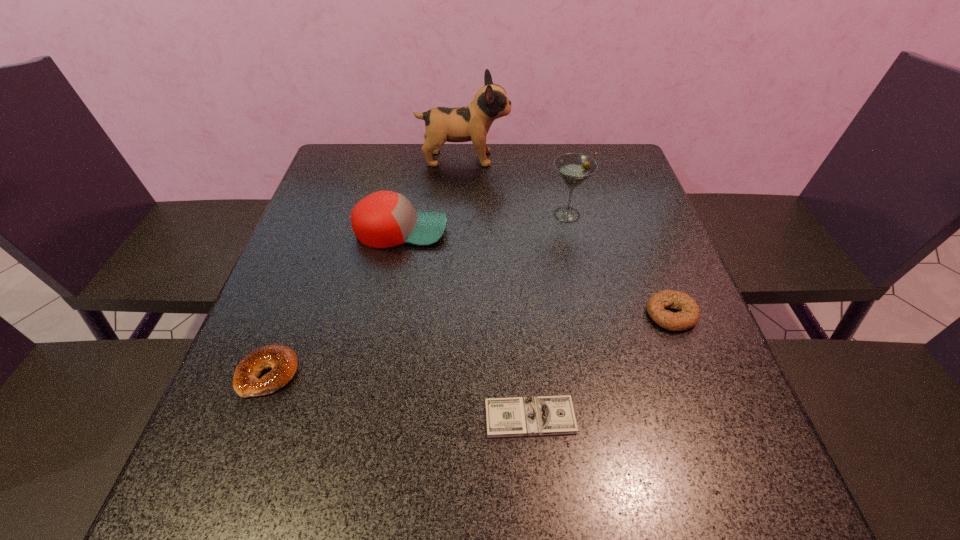
In the image, there is a desktop. In order to click on vacant area at the far edge in this screenshot , I will do `click(430, 169)`.

In the image, there is a desktop. Where is `vacant region at the near edge`? Image resolution: width=960 pixels, height=540 pixels. vacant region at the near edge is located at coordinates (346, 511).

Image resolution: width=960 pixels, height=540 pixels. I want to click on vacant region at the left edge of the desktop, so click(x=284, y=276).

What are the coordinates of `free spot at the right edge of the desktop` in the screenshot? It's located at (598, 190).

Find the location of a particular element. The width and height of the screenshot is (960, 540). blank space at the far left corner of the desktop is located at coordinates (328, 165).

In the image, there is a desktop. Where is `free space at the near left corner`? The width and height of the screenshot is (960, 540). free space at the near left corner is located at coordinates (258, 503).

Locate an element on the screen. free spot between the puppy and the shortest object is located at coordinates (497, 288).

This screenshot has height=540, width=960. I want to click on vacant area that lies between the right bagel and the farthest object, so click(x=567, y=237).

Locate an element on the screen. vacant area between the farthest object and the second object from right to left is located at coordinates (516, 187).

The width and height of the screenshot is (960, 540). I want to click on free space between the third nearest object and the tallest object, so tap(567, 237).